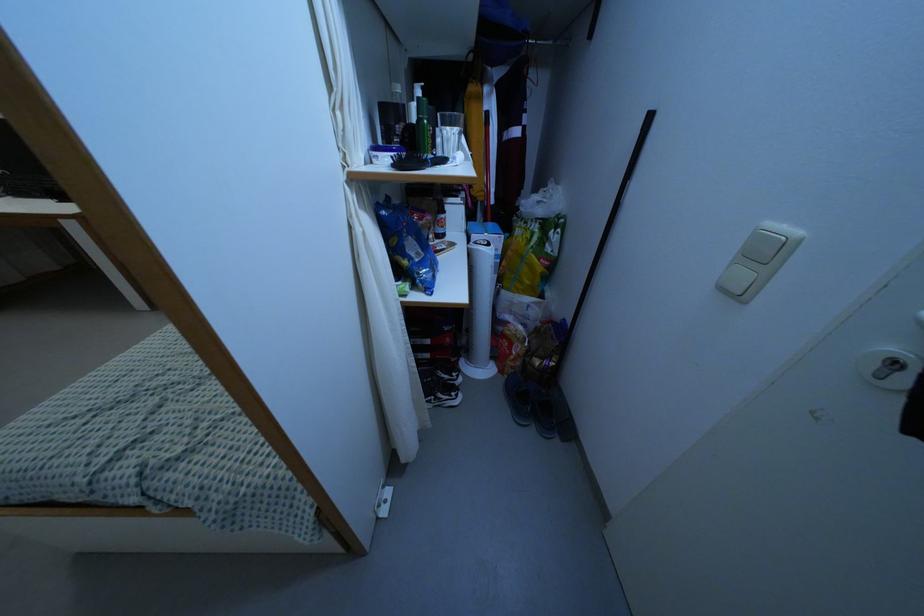
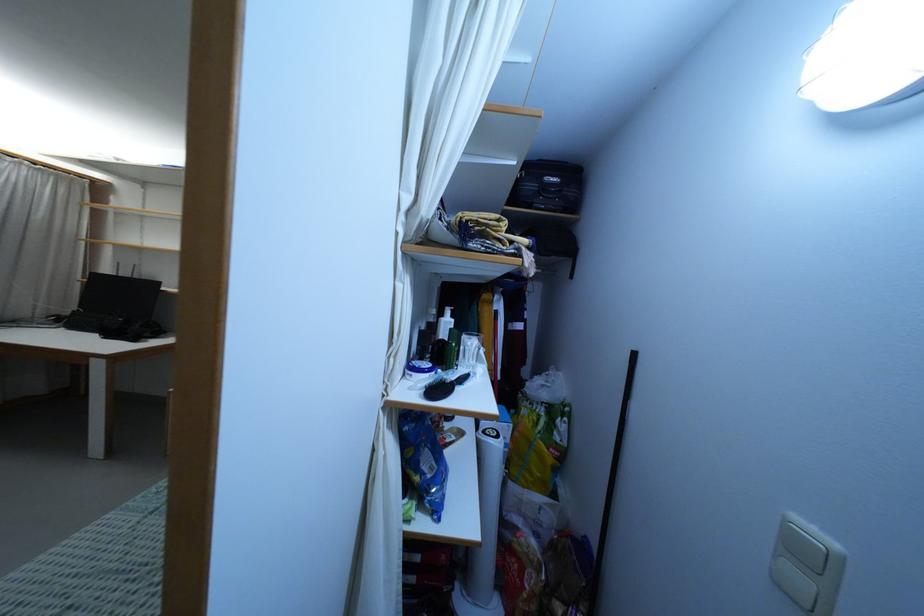
In the second image, find the point that corresponds to (x=409, y=257) in the first image.

(422, 474)